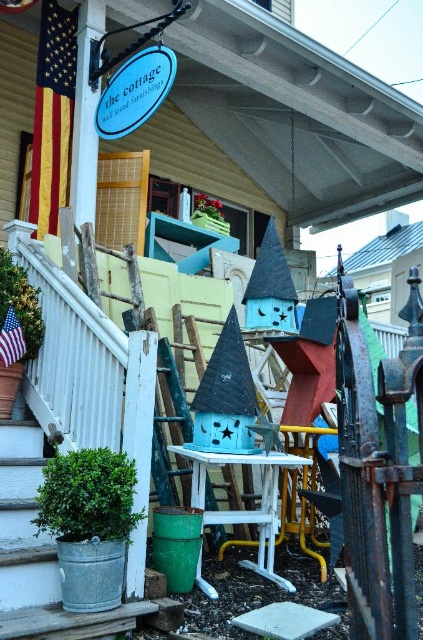
Question: Can you confirm if green galvanized bucket at lower left is positioned below american flag at left?

Choices:
 (A) yes
 (B) no

Answer: (A)

Question: Which of the following is the closest to the observer?

Choices:
 (A) american flag fabric at left
 (B) american flag at left

Answer: (A)

Question: Which of the following is the closest to the observer?

Choices:
 (A) (32, 150)
 (B) (5, 422)
 (C) (2, 364)
 (D) (123, 353)

Answer: (D)

Question: Which object is closer to the camera taking this photo?

Choices:
 (A) matte blue birdhouse at center
 (B) american flag fabric at left
 (C) green galvanized bucket at lower left
 (D) american flag at left

Answer: (C)

Question: Does green galvanized bucket at lower left lie behind american flag fabric at left?

Choices:
 (A) no
 (B) yes

Answer: (A)

Question: In this image, where is matte blue birdhouse at center located relative to american flag at left?

Choices:
 (A) right
 (B) left

Answer: (A)